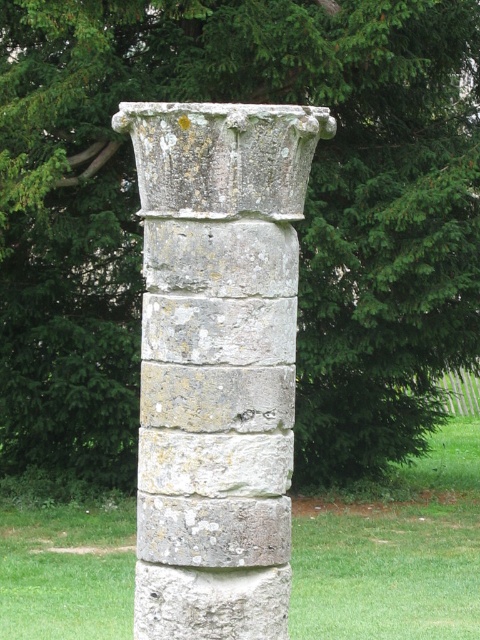
Can you confirm if weathered stone column at center is shorter than green grass at center?

Incorrect, weathered stone column at center's height does not fall short of green grass at center's.

Is weathered stone column at center above green grass at center?

Yes.

Measure the distance between weathered stone column at center and camera.

weathered stone column at center and camera are 19.48 feet apart.

Find the location of a particular element. Image resolution: width=480 pixels, height=640 pixels. weathered stone column at center is located at coordinates (217, 362).